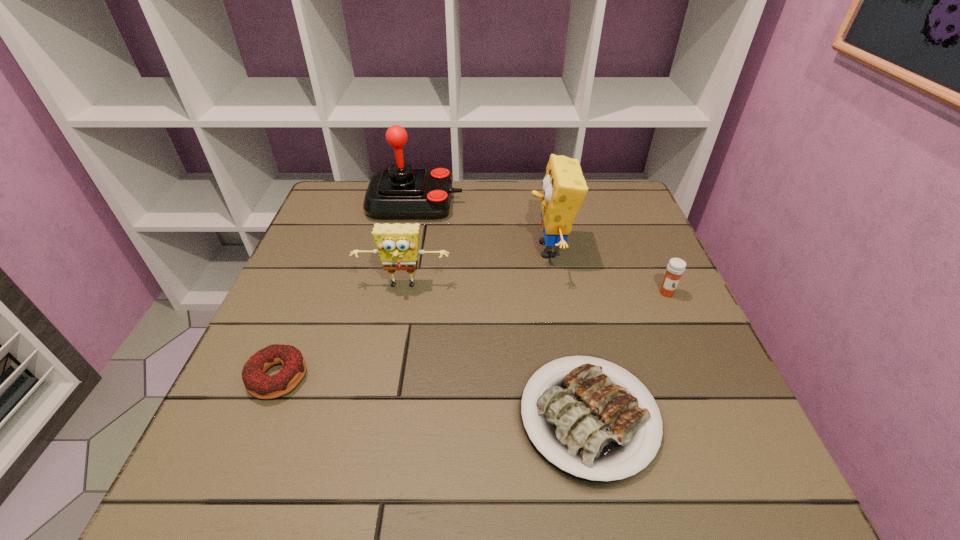
The width and height of the screenshot is (960, 540). Identify the location of unoccupied area between the right sponge and the leftmost object. (414, 313).

Where is `vacant area that lies between the leftmost object and the shorter sponge`? The height and width of the screenshot is (540, 960). vacant area that lies between the leftmost object and the shorter sponge is located at coordinates (341, 332).

Locate an element on the screen. This screenshot has width=960, height=540. free point between the fifth tallest object and the joystick is located at coordinates (347, 290).

I want to click on blank region between the rightmost object and the plate, so click(628, 355).

Image resolution: width=960 pixels, height=540 pixels. Identify the location of vacant area that lies between the plate and the rightmost object. (628, 355).

The height and width of the screenshot is (540, 960). I want to click on free space between the leftmost object and the medicine, so click(472, 335).

Locate an element on the screen. This screenshot has height=540, width=960. empty space that is in between the right sponge and the doughnut is located at coordinates (414, 313).

Where is `free space between the rightmost object and the plate`? free space between the rightmost object and the plate is located at coordinates point(628,355).

Identify the location of object that stands as the fifth closest to the rightmost object. (259, 384).

Find the location of `object that is the fifth closest one to the joystick`. object that is the fifth closest one to the joystick is located at coordinates (676, 267).